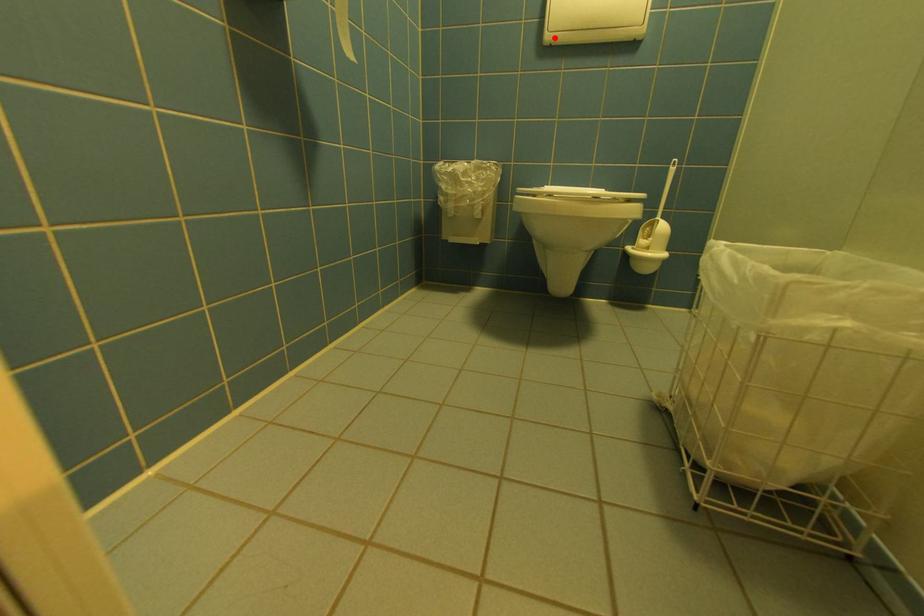
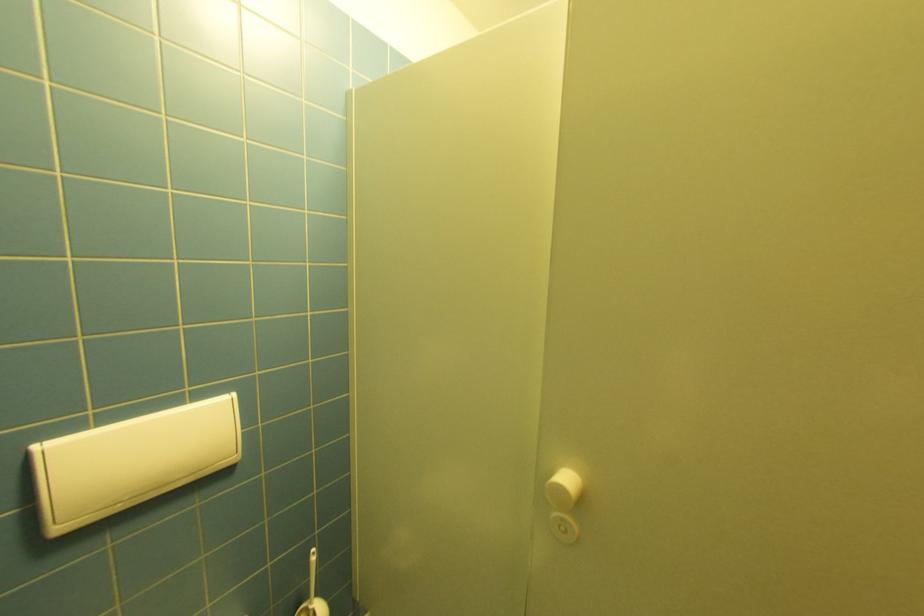
Find the pixel in the second image that matches the highlighted location in the first image.

(66, 530)